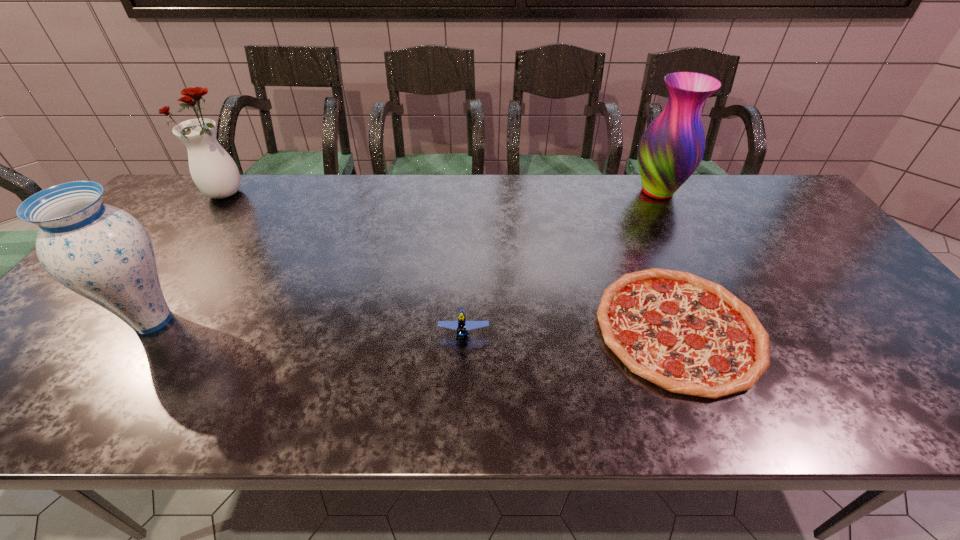
The image size is (960, 540). I want to click on the rightmost vase, so click(672, 147).

This screenshot has height=540, width=960. In order to click on the nearest vase in this screenshot , I will do `click(101, 252)`.

This screenshot has height=540, width=960. Find the location of `the fourth tallest object`. the fourth tallest object is located at coordinates (462, 325).

The height and width of the screenshot is (540, 960). Find the location of `Lego`. Lego is located at coordinates (462, 325).

You are a GUI agent. You are given a task and a screenshot of the screen. Output one action in this format:
    pyautogui.click(x=<x>, y=<y>)
    Task: Click on the pizza
    
    Given the screenshot: What is the action you would take?
    pyautogui.click(x=688, y=335)

What are the coordinates of `free region located 0.400m on the front of the rightmost vase` in the screenshot? It's located at (714, 302).

Where is `free location located 0.110m on the left of the nearest vase`? The height and width of the screenshot is (540, 960). free location located 0.110m on the left of the nearest vase is located at coordinates (69, 321).

The height and width of the screenshot is (540, 960). Identify the location of vacant space located 0.140m on the front-facing side of the Lego. (461, 406).

At what (x,y) coordinates should I click in order to perform the action: click on vacant space located on the back of the pizza. Please return your answer as a coordinate pair (x, y). Looking at the image, I should click on (626, 202).

Identify the location of object that is positioned at the near edge. (688, 335).